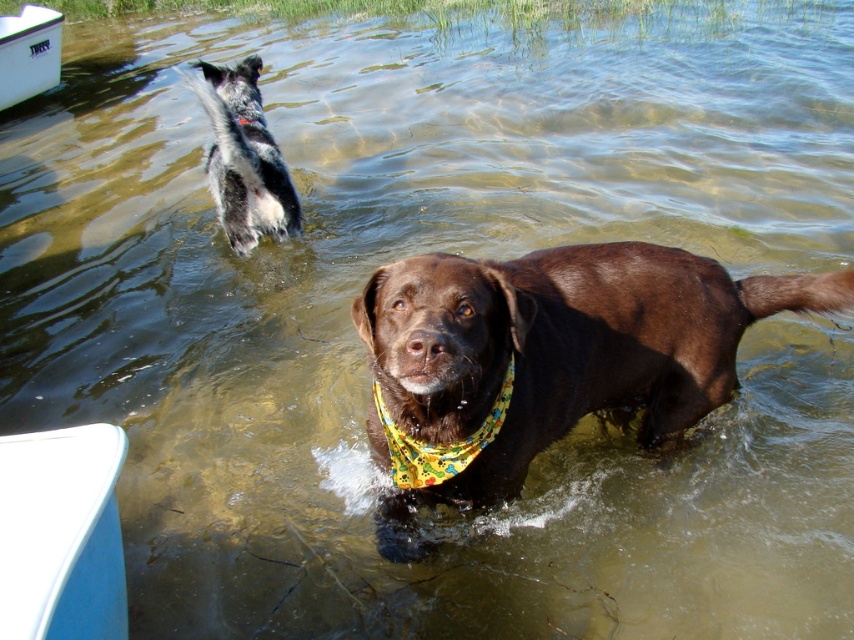
Question: Does yellow fabric bandana at center have a larger size compared to white plastic boat at upper left?

Choices:
 (A) yes
 (B) no

Answer: (B)

Question: Which of the following is the closest to the observer?

Choices:
 (A) white plastic boat at upper left
 (B) black and white fur at upper left

Answer: (B)

Question: Can you confirm if white plastic boat at lower left is positioned to the left of black and white fur at upper left?

Choices:
 (A) yes
 (B) no

Answer: (B)

Question: Is brown matte dog at center positioned before white plastic boat at lower left?

Choices:
 (A) yes
 (B) no

Answer: (B)

Question: Which of the following is the closest to the observer?

Choices:
 (A) black and white fur at upper left
 (B) yellow fabric bandana at center

Answer: (B)

Question: Which point is closer to the camera taking this photo?

Choices:
 (A) (407, 440)
 (B) (32, 28)
 (C) (94, 534)

Answer: (C)